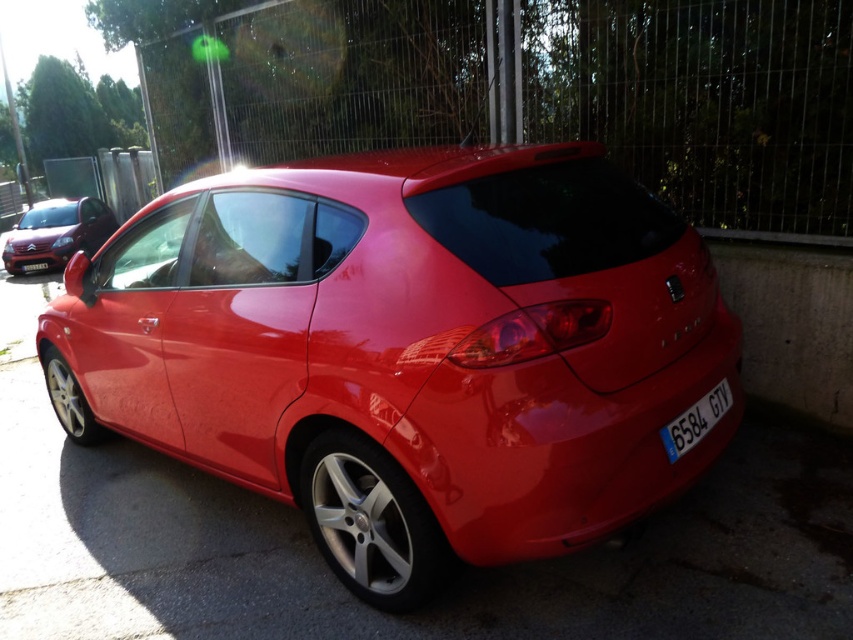
Question: Does glossy red car at center appear on the right side of white plastic license plate at center?

Choices:
 (A) no
 (B) yes

Answer: (B)

Question: Which of the following is the farthest from the observer?

Choices:
 (A) (689, 417)
 (B) (206, 396)
 (C) (30, 264)

Answer: (C)

Question: Which of the following is the farthest from the observer?

Choices:
 (A) glossy red car at center
 (B) glossy metallic car at left
 (C) white plastic license plate at rear

Answer: (B)

Question: Is glossy metallic car at left wider than white plastic license plate at rear?

Choices:
 (A) no
 (B) yes

Answer: (B)

Question: Which object appears closest to the camera in this image?

Choices:
 (A) glossy red car at center
 (B) white plastic license plate at center
 (C) glossy metallic car at left
 (D) white plastic license plate at rear

Answer: (A)

Question: Is the position of glossy red car at center more distant than that of glossy metallic car at left?

Choices:
 (A) no
 (B) yes

Answer: (A)